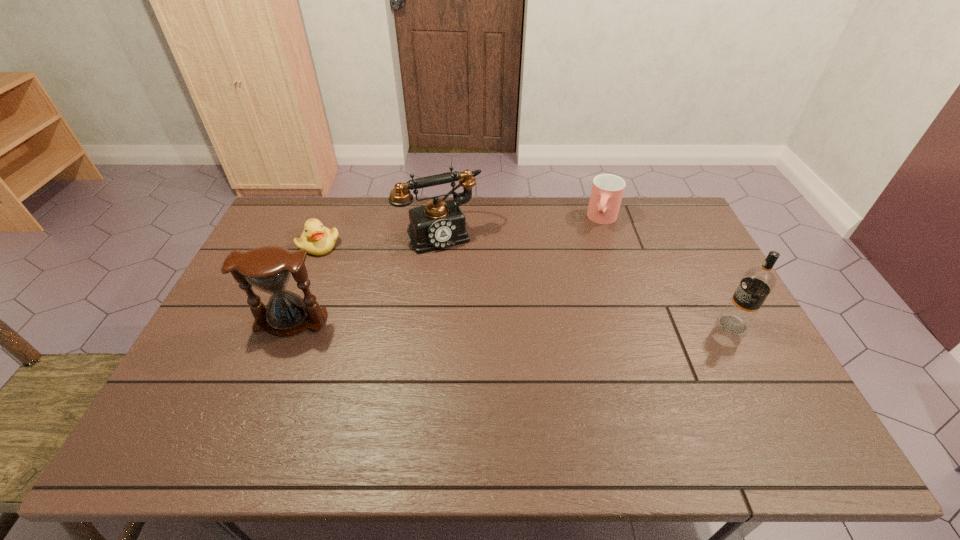
Where is `vacant position located on the front-facing side of the shortest object`? vacant position located on the front-facing side of the shortest object is located at coordinates (375, 275).

Identify the location of vacant area located 0.160m on the front-facing side of the shortest object. (368, 271).

At what (x,y) coordinates should I click in order to perform the action: click on vacant space located on the front-facing side of the shortest object. Please return your answer as a coordinate pair (x, y). The image size is (960, 540). Looking at the image, I should click on (419, 299).

I want to click on vacant space positioned 0.350m on the front of the telephone at the rotary dial, so click(492, 331).

Where is `vacant space located on the front of the telephone at the rotary dial`? The height and width of the screenshot is (540, 960). vacant space located on the front of the telephone at the rotary dial is located at coordinates (477, 301).

Where is `free region located 0.380m on the front of the telephone at the rotary dial`? The height and width of the screenshot is (540, 960). free region located 0.380m on the front of the telephone at the rotary dial is located at coordinates (495, 339).

Locate an element on the screen. The image size is (960, 540). free space located on the side of the second object from right to left with the handle is located at coordinates (590, 267).

Locate an element on the screen. The image size is (960, 540). vacant space located 0.310m on the side of the second object from right to left with the handle is located at coordinates (583, 291).

The height and width of the screenshot is (540, 960). What are the coordinates of `vacant area located on the side of the second object from right to left with the handle` in the screenshot? It's located at (592, 262).

Identify the location of duckling present at the far edge. (316, 239).